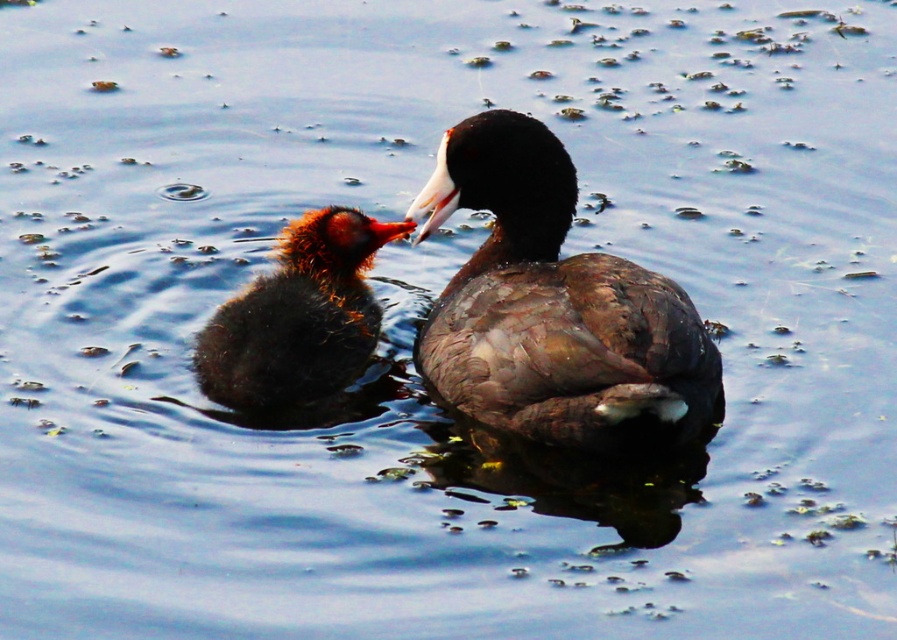
You are observing two ducklings in the water. The scene shows a brown feathered duckling at center and a brown downy duckling at center. Which duckling is positioned higher in the image?

The brown feathered duckling at center is positioned higher than the brown downy duckling at center.

You are a wildlife photographer trying to capture a closeup shot of the brown feathered duckling at center. Your camera has a zoom lens that can focus on a specific point. The point you need to focus on is given as point [554,308]. Based on the scene description, where should you aim your camera to ensure the brown feathered duckling at center is in focus?

The point [554,308] indicates the location of the brown feathered duckling at center. Aim your camera at this coordinate to ensure the brown feathered duckling at center is in focus.

From the picture: You are a wildlife photographer trying to capture a closeup shot of both the brown feathered duckling at center and the brown downy duckling at center. Given that your camera has a minimum focusing distance of 12 inches, will you be able to take the photo without moving closer?

The distance between the brown feathered duckling at center and the brown downy duckling at center is 10.71 inches, which is less than the camera minimum focusing distance of 12 inches. Therefore, you can take the photo without moving closer.